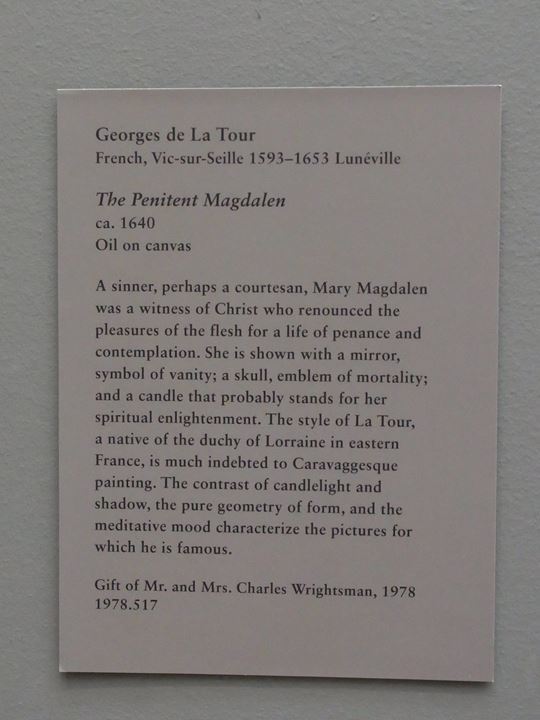
Where is `type of painting "oil on canvas"`? This screenshot has width=540, height=720. type of painting "oil on canvas" is located at coordinates (98, 243).